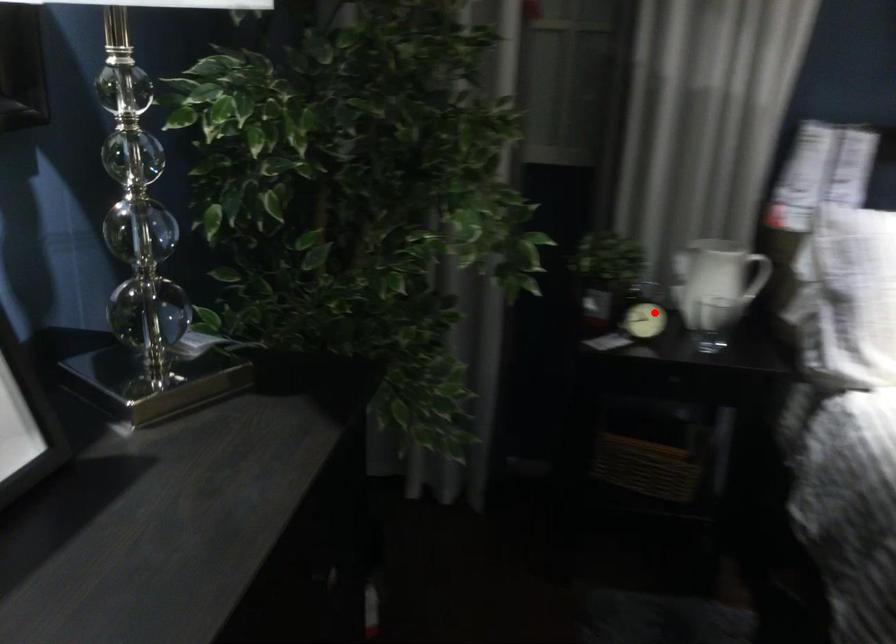
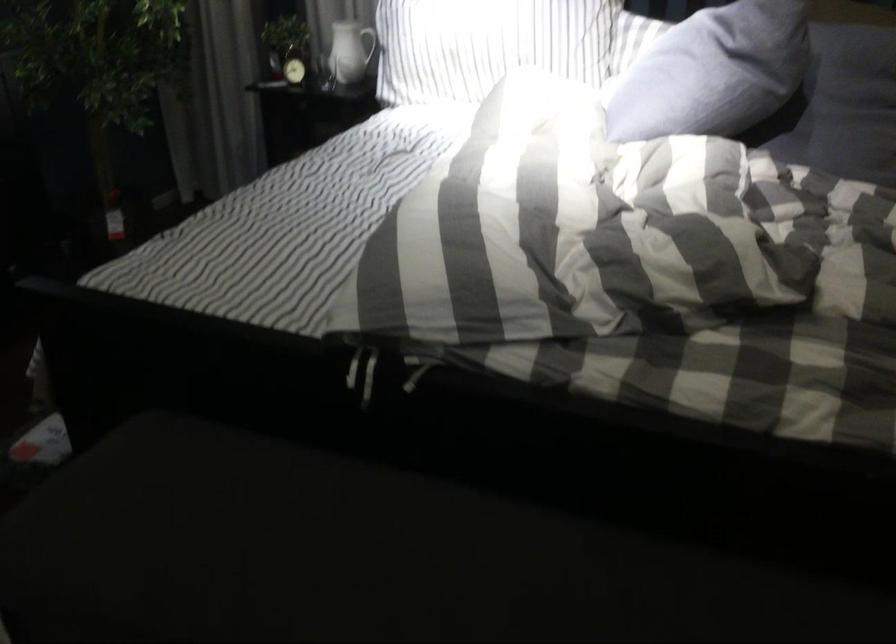
Question: I am providing you with two images of the same scene from different viewpoints. In image1, a red point is highlighted. Considering the same 3D point in image2, which of the following is correct?

Choices:
 (A) It is closer
 (B) It is farther

Answer: (B)